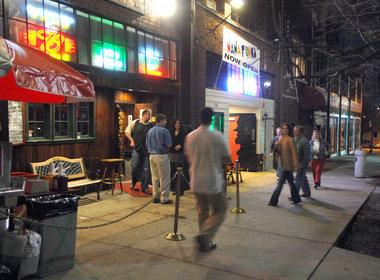
Where is `neon green light`? Image resolution: width=380 pixels, height=280 pixels. neon green light is located at coordinates (368, 158), (123, 57).